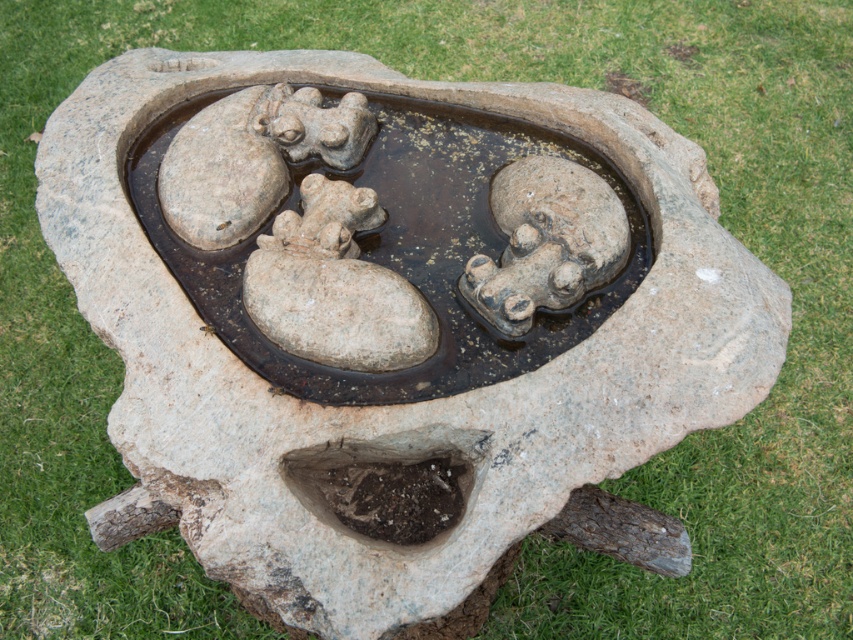
Who is higher up, gray stone frog at upper center or smooth stone frog at center?

gray stone frog at upper center

Can you confirm if gray stone frog at upper center is shorter than smooth stone frog at center?

No.

Is point (267, 88) farther from camera compared to point (329, 227)?

Yes, it is behind point (329, 227).

This screenshot has width=853, height=640. Find the location of `gray stone frog at upper center`. gray stone frog at upper center is located at coordinates (314, 124).

Who is higher up, rough stone frog at center or smooth stone frog at center?

smooth stone frog at center is above.

Is rough stone frog at center bigger than smooth stone frog at center?

Correct, rough stone frog at center is larger in size than smooth stone frog at center.

Is point (532, 314) farther from viewer compared to point (321, 240)?

No, it is not.

Identify the location of rough stone frog at center. This screenshot has height=640, width=853. (546, 241).

This screenshot has height=640, width=853. What do you see at coordinates (546, 241) in the screenshot?
I see `rough stone frog at center` at bounding box center [546, 241].

Is rough stone frog at center thinner than gray stone frog at upper center?

No.

Who is more distant from viewer, (495, 269) or (309, 88)?

Point (309, 88)

Where is `rough stone frog at center`? The width and height of the screenshot is (853, 640). rough stone frog at center is located at coordinates (546, 241).